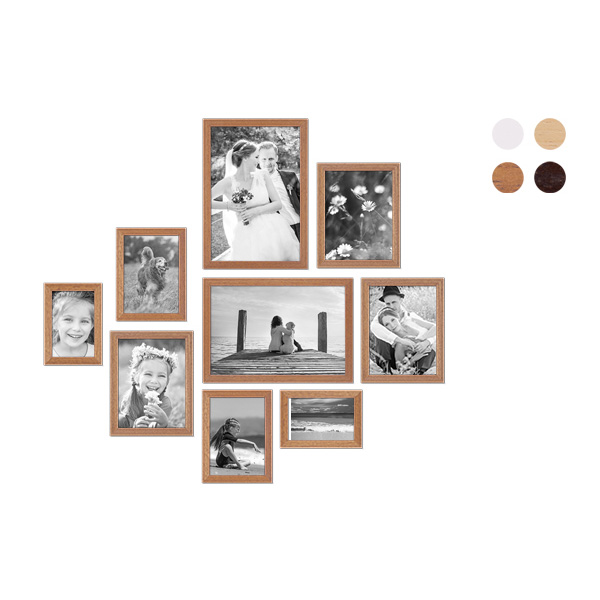
The width and height of the screenshot is (600, 600). Find the location of `framed pictures`. framed pictures is located at coordinates (65, 322), (135, 267), (159, 401), (286, 310), (232, 423), (348, 418), (357, 196), (294, 187), (408, 345).